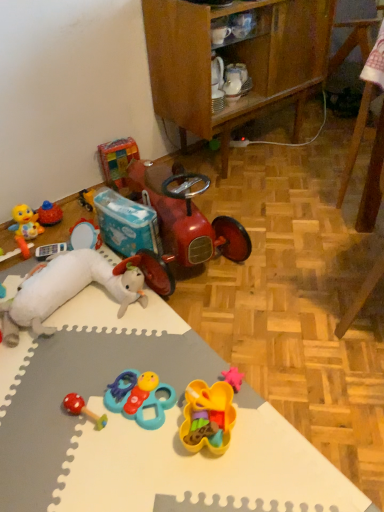
Question: From a real-world perspective, is rubberized red mushroom rattle at lower left, the fourth toy when ordered from back to front, physically above white foam mat at lower left?

Choices:
 (A) no
 (B) yes

Answer: (B)

Question: Is white foam mat at lower left at the back of rubberized red mushroom rattle at lower left, the fourth toy when ordered from back to front?

Choices:
 (A) no
 (B) yes

Answer: (A)

Question: Is rubberized red mushroom rattle at lower left, the 2th toy in the front-to-back sequence, completely or partially outside of white foam mat at lower left?

Choices:
 (A) yes
 (B) no

Answer: (A)

Question: From the image's perspective, does rubberized red mushroom rattle at lower left, the 5th toy viewed from the top, appear higher than white foam mat at lower left?

Choices:
 (A) no
 (B) yes

Answer: (A)

Question: Does rubberized red mushroom rattle at lower left, arranged as the first toy when ordered from the bottom, appear on the right side of white foam mat at lower left?

Choices:
 (A) no
 (B) yes

Answer: (A)

Question: Does rubberized red mushroom rattle at lower left, arranged as the first toy when ordered from the bottom, come behind white foam mat at lower left?

Choices:
 (A) no
 (B) yes

Answer: (B)

Question: From the image's perspective, is shiny red toy car at center below rubberized red mushroom rattle at lower left, arranged as the first toy when ordered from the bottom?

Choices:
 (A) yes
 (B) no

Answer: (B)

Question: From a real-world perspective, is shiny red toy car at center positioned under rubberized red mushroom rattle at lower left, arranged as the first toy when ordered from the bottom, based on gravity?

Choices:
 (A) no
 (B) yes

Answer: (A)

Question: Can you confirm if shiny red toy car at center is bigger than rubberized red mushroom rattle at lower left, arranged as the first toy when ordered from the bottom?

Choices:
 (A) no
 (B) yes

Answer: (B)

Question: Can you confirm if shiny red toy car at center is positioned to the right of rubberized red mushroom rattle at lower left, the 5th toy viewed from the top?

Choices:
 (A) no
 (B) yes

Answer: (B)

Question: Could you tell me if shiny red toy car at center is facing rubberized red mushroom rattle at lower left, the 2th toy in the front-to-back sequence?

Choices:
 (A) yes
 (B) no

Answer: (B)

Question: Is shiny red toy car at center positioned in front of rubberized red mushroom rattle at lower left, the 2th toy in the front-to-back sequence?

Choices:
 (A) no
 (B) yes

Answer: (A)

Question: Is plastic colorful blocks at upper left, which appears as the first toy when viewed from the top, wider than rubberized red mushroom rattle at lower left, arranged as the first toy when ordered from the bottom?

Choices:
 (A) no
 (B) yes

Answer: (A)